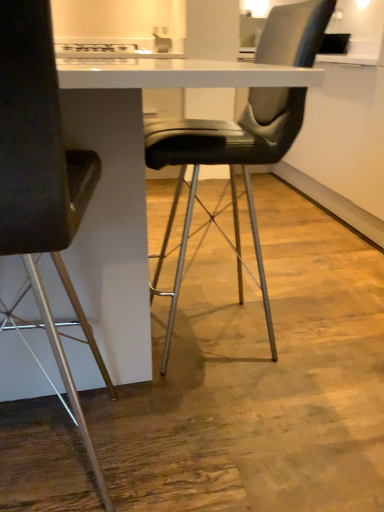
Measure the distance between matte black chair at left, which is the second chair in right-to-left order, and camera.

matte black chair at left, which is the second chair in right-to-left order, is 18.35 inches away from camera.

The width and height of the screenshot is (384, 512). Find the location of `matte black chair at left, the 1th chair when ordered from left to right`. matte black chair at left, the 1th chair when ordered from left to right is located at coordinates (42, 178).

The height and width of the screenshot is (512, 384). What do you see at coordinates (42, 178) in the screenshot? I see `matte black chair at left, the 1th chair when ordered from left to right` at bounding box center [42, 178].

The width and height of the screenshot is (384, 512). Identify the location of black leather chair at center, the first chair positioned from the right. (230, 170).

In order to face black leather chair at center, the first chair positioned from the right, should I rotate leftwards or rightwards?

Rotate your view right by about 4.527°.

This screenshot has width=384, height=512. Describe the element at coordinates (230, 170) in the screenshot. I see `black leather chair at center, the first chair positioned from the right` at that location.

You are a GUI agent. You are given a task and a screenshot of the screen. Output one action in this format:
    pyautogui.click(x=<x>, y=<y>)
    Task: Click on the matte black chair at left, the 1th chair when ordered from left to right
    The width and height of the screenshot is (384, 512).
    Given the screenshot: What is the action you would take?
    pyautogui.click(x=42, y=178)

Can you confirm if matte black chair at left, which is the second chair in right-to-left order, is positioned to the right of black leather chair at center, the first chair positioned from the right?

In fact, matte black chair at left, which is the second chair in right-to-left order, is to the left of black leather chair at center, the first chair positioned from the right.

Considering their positions, is matte black chair at left, the 1th chair when ordered from left to right, located in front of or behind black leather chair at center, the first chair positioned from the right?

In the image, matte black chair at left, the 1th chair when ordered from left to right, appears in front of black leather chair at center, the first chair positioned from the right.

Considering the points (95, 459) and (161, 260), which point is behind, point (95, 459) or point (161, 260)?

The point (161, 260) is behind.

From the image's perspective, which one is positioned higher, matte black chair at left, the 1th chair when ordered from left to right, or black leather chair at center, the first chair positioned from the right?

black leather chair at center, the first chair positioned from the right, appears higher in the image.

From a real-world perspective, is matte black chair at left, which is the second chair in right-to-left order, physically below black leather chair at center, placed as the second chair when sorted from left to right?

A: Correct, in the physical world, matte black chair at left, which is the second chair in right-to-left order, is lower than black leather chair at center, placed as the second chair when sorted from left to right.

Between matte black chair at left, the 1th chair when ordered from left to right, and black leather chair at center, the first chair positioned from the right, which one has smaller width?

matte black chair at left, the 1th chair when ordered from left to right, is thinner.

Between matte black chair at left, which is the second chair in right-to-left order, and black leather chair at center, the first chair positioned from the right, which one has more height?

black leather chair at center, the first chair positioned from the right.

Which of these two, matte black chair at left, the 1th chair when ordered from left to right, or black leather chair at center, placed as the second chair when sorted from left to right, is smaller?

matte black chair at left, the 1th chair when ordered from left to right.

Is matte black chair at left, the 1th chair when ordered from left to right, completely or partially outside of black leather chair at center, the first chair positioned from the right?

matte black chair at left, the 1th chair when ordered from left to right, lies outside black leather chair at center, the first chair positioned from the right,'s area.

Can you see matte black chair at left, which is the second chair in right-to-left order, touching black leather chair at center, placed as the second chair when sorted from left to right?

matte black chair at left, which is the second chair in right-to-left order, and black leather chair at center, placed as the second chair when sorted from left to right, are not in contact.

Is matte black chair at left, the 1th chair when ordered from left to right, oriented towards black leather chair at center, the first chair positioned from the right?

No, matte black chair at left, the 1th chair when ordered from left to right, is not aimed at black leather chair at center, the first chair positioned from the right.

Can you tell me how much matte black chair at left, the 1th chair when ordered from left to right, and black leather chair at center, placed as the second chair when sorted from left to right, differ in facing direction?

The angle between the facing direction of matte black chair at left, the 1th chair when ordered from left to right, and the facing direction of black leather chair at center, placed as the second chair when sorted from left to right, is 90.8 degrees.

Identify the location of chair that is behind the matte black chair at left, which is the second chair in right-to-left order. (230, 170).

Considering the positions of objects black leather chair at center, placed as the second chair when sorted from left to right, and matte black chair at left, the 1th chair when ordered from left to right, in the image provided, who is more to the right, black leather chair at center, placed as the second chair when sorted from left to right, or matte black chair at left, the 1th chair when ordered from left to right,?

From the viewer's perspective, black leather chair at center, placed as the second chair when sorted from left to right, appears more on the right side.

Is black leather chair at center, the first chair positioned from the right, in front of or behind matte black chair at left, which is the second chair in right-to-left order, in the image?

Clearly, black leather chair at center, the first chair positioned from the right, is behind matte black chair at left, which is the second chair in right-to-left order.

Considering the positions of points (270, 316) and (35, 66), is point (270, 316) closer to camera compared to point (35, 66)?

No, it is behind (35, 66).

From the image's perspective, which one is positioned lower, black leather chair at center, the first chair positioned from the right, or matte black chair at left, the 1th chair when ordered from left to right?

matte black chair at left, the 1th chair when ordered from left to right, appears lower in the image.

From a real-world perspective, is black leather chair at center, the first chair positioned from the right, positioned above or below matte black chair at left, the 1th chair when ordered from left to right?

In terms of real-world spatial position, black leather chair at center, the first chair positioned from the right, is above matte black chair at left, the 1th chair when ordered from left to right.

Considering the sizes of objects black leather chair at center, the first chair positioned from the right, and matte black chair at left, the 1th chair when ordered from left to right, in the image provided, who is thinner, black leather chair at center, the first chair positioned from the right, or matte black chair at left, the 1th chair when ordered from left to right,?

matte black chair at left, the 1th chair when ordered from left to right, is thinner.

Which of these two, black leather chair at center, the first chair positioned from the right, or matte black chair at left, the 1th chair when ordered from left to right, stands taller?

black leather chair at center, the first chair positioned from the right, is taller.

Between black leather chair at center, the first chair positioned from the right, and matte black chair at left, the 1th chair when ordered from left to right, which one has larger size?

black leather chair at center, the first chair positioned from the right, is bigger.

Is black leather chair at center, placed as the second chair when sorted from left to right, inside the boundaries of matte black chair at left, which is the second chair in right-to-left order, or outside?

The correct answer is: outside.

Is black leather chair at center, placed as the second chair when sorted from left to right, not close to matte black chair at left, the 1th chair when ordered from left to right?

They are positioned close to each other.

Is black leather chair at center, placed as the second chair when sorted from left to right, facing towards matte black chair at left, the 1th chair when ordered from left to right?

No, black leather chair at center, placed as the second chair when sorted from left to right, is not aimed at matte black chair at left, the 1th chair when ordered from left to right.

How different are the orientations of black leather chair at center, the first chair positioned from the right, and matte black chair at left, which is the second chair in right-to-left order, in degrees?

The angular difference between black leather chair at center, the first chair positioned from the right, and matte black chair at left, which is the second chair in right-to-left order, is 90.8 degrees.

The width and height of the screenshot is (384, 512). Identify the location of chair behind the matte black chair at left, which is the second chair in right-to-left order. (230, 170).

Find the location of `chair above the matte black chair at left, which is the second chair in right-to-left order (from the image's perspective)`. chair above the matte black chair at left, which is the second chair in right-to-left order (from the image's perspective) is located at coordinates pos(230,170).

The image size is (384, 512). I want to click on chair above the matte black chair at left, which is the second chair in right-to-left order (from a real-world perspective), so click(x=230, y=170).